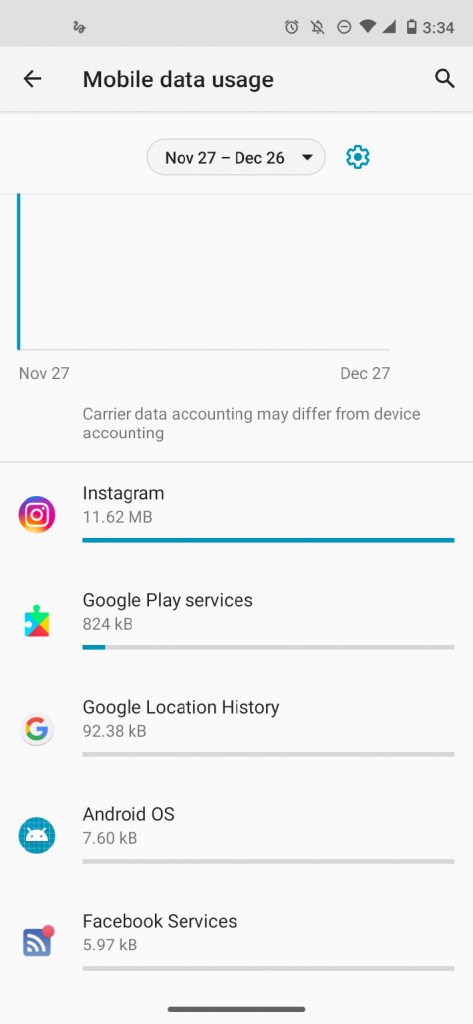
Locate an element on the screen. alarm is located at coordinates (290, 23).